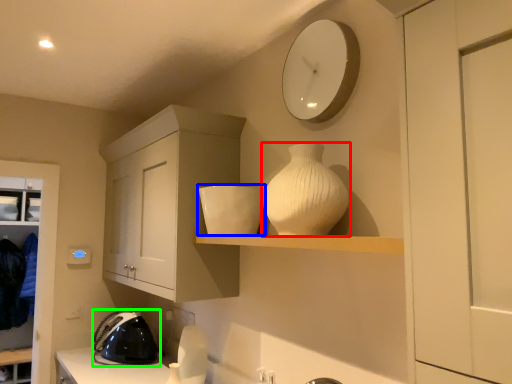
Question: Which object is the farthest from vase (highlighted by a red box)? Choose among these: appliance (highlighted by a blue box) or appliance (highlighted by a green box).

Choices:
 (A) appliance
 (B) appliance

Answer: (B)